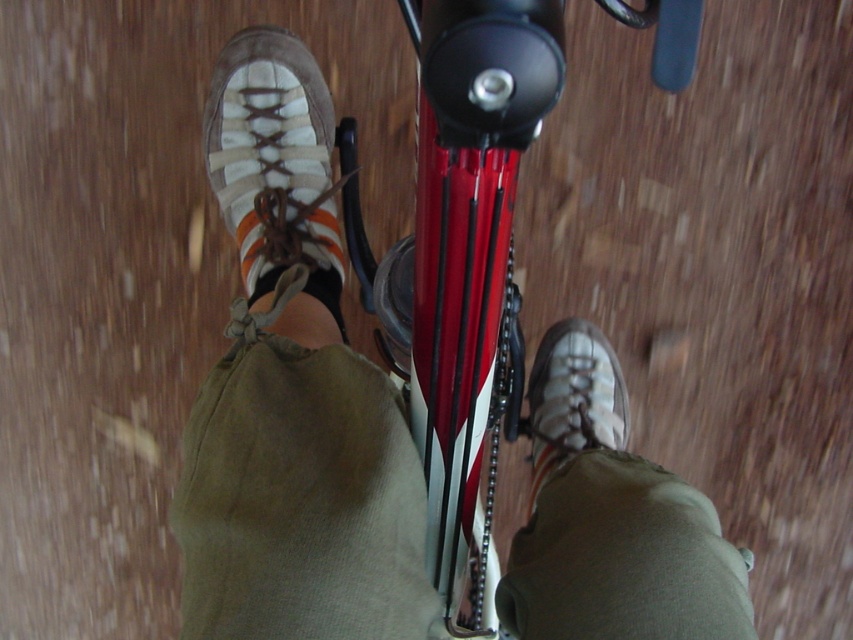
Who is shorter, leather shoe at center or brown suede shoe at lower right?

Standing shorter between the two is brown suede shoe at lower right.

Which is behind, point (239, 490) or point (535, 356)?

The point (535, 356) is more distant.

Locate an element on the screen. The height and width of the screenshot is (640, 853). leather shoe at center is located at coordinates (292, 394).

Is leather shoe at center bigger than brown suede shoe at upper left?

Correct, leather shoe at center is larger in size than brown suede shoe at upper left.

Does leather shoe at center appear over brown suede shoe at upper left?

No, leather shoe at center is not above brown suede shoe at upper left.

This screenshot has width=853, height=640. What do you see at coordinates (292, 394) in the screenshot?
I see `leather shoe at center` at bounding box center [292, 394].

Where is `leather shoe at center`? This screenshot has width=853, height=640. leather shoe at center is located at coordinates (292, 394).

Does brown suede shoe at upper left lie in front of brown suede shoe at lower right?

Yes, brown suede shoe at upper left is in front of brown suede shoe at lower right.

Between brown suede shoe at upper left and brown suede shoe at lower right, which one is positioned higher?

brown suede shoe at upper left

Where is `brown suede shoe at upper left`? This screenshot has height=640, width=853. brown suede shoe at upper left is located at coordinates (274, 163).